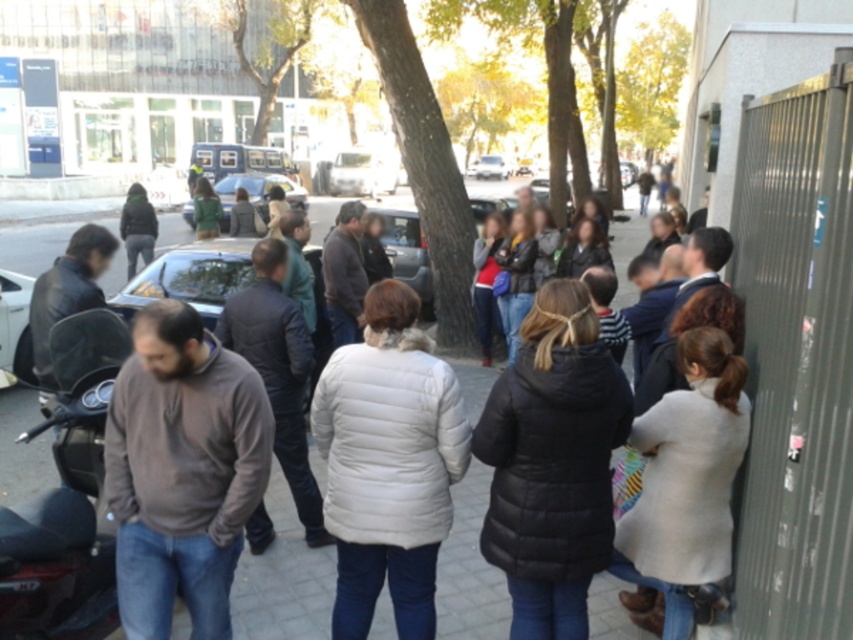
Question: Is black puffy coat at center above gray quilted jacket at center?

Choices:
 (A) no
 (B) yes

Answer: (A)

Question: Among these points, which one is farthest from the camera?

Choices:
 (A) (299, 499)
 (B) (281, 620)

Answer: (A)

Question: Can you confirm if black puffy coat at center is positioned above shiny black car at center?

Choices:
 (A) no
 (B) yes

Answer: (A)

Question: Which is farther from the gray quilted jacket at center?

Choices:
 (A) white puffy coat at center
 (B) metallic silver van at center
 (C) shiny black car at center

Answer: (B)

Question: Which point is closer to the camera taking this photo?

Choices:
 (A) (25, 339)
 (B) (120, 300)

Answer: (B)

Question: Does gray quilted jacket at center appear over metallic silver van at center?

Choices:
 (A) yes
 (B) no

Answer: (B)